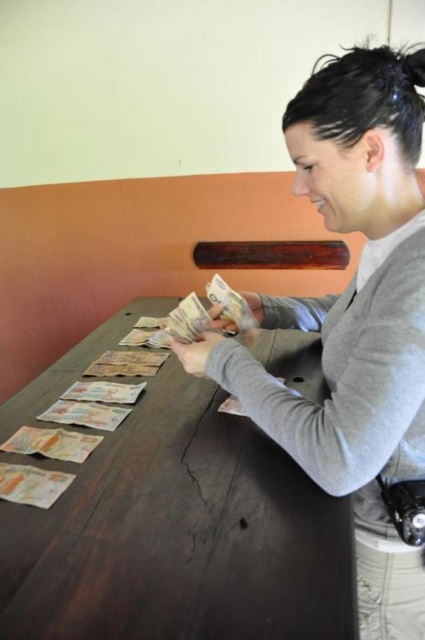
Does dark brown wood table at center have a greater height compared to gray matte sweater at center?

No.

Does point (263, 570) come closer to viewer compared to point (391, 241)?

Yes, it is in front of point (391, 241).

Find the location of a particular element. The image size is (425, 640). dark brown wood table at center is located at coordinates (180, 536).